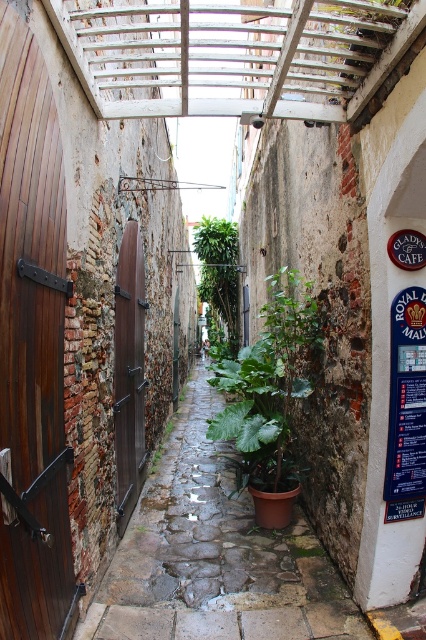
You are a delivery person trying to navigate through the narrow alleyway. You need to pass by the brown wooden door at left and the green leafy plant at center. Which object should you move around first as you go forward?

You should move around the brown wooden door at left first because it is positioned to the left of the green leafy plant at center, meaning it comes before the plant when moving forward through the alleyway.

You are standing in the narrow alleyway and want to place a small decorative item. You have two points marked on the ground where you can place it. The first point is at coordinates point (17, 592), and the second is at point (129, 468). Which point is closer to you so that the item is more visible to visitors entering the alley?

Point (17, 592) is closer to the viewer than point (129, 468), so placing the item there would make it more visible to visitors entering the alley.

You are a delivery person carrying a package that requires a 5 meter walkway to maneuver. You are in the alleyway and need to pass between the brown wooden door at left and the green leafy plant at center. Is there enough space for your delivery vehicle to pass through?

The distance between the brown wooden door at left and the green leafy plant at center is 6.27 meters, which is more than the required 5 meters, so there is sufficient space for the delivery vehicle to pass through.